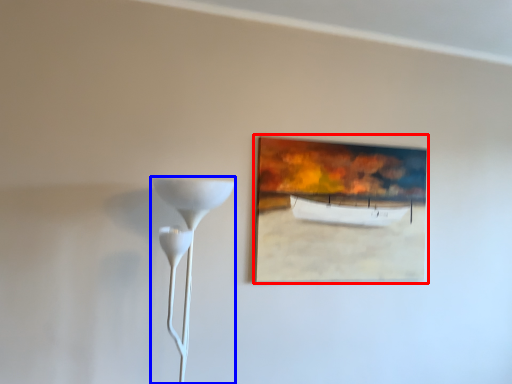
Question: Which object appears closest to the camera in this image, picture frame (highlighted by a red box) or lamp (highlighted by a blue box)?

Choices:
 (A) picture frame
 (B) lamp

Answer: (B)